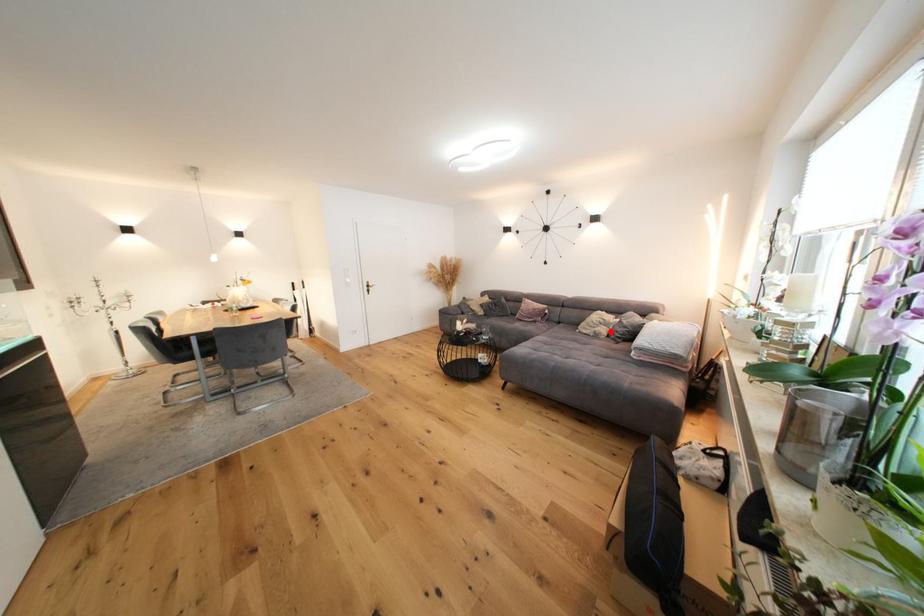
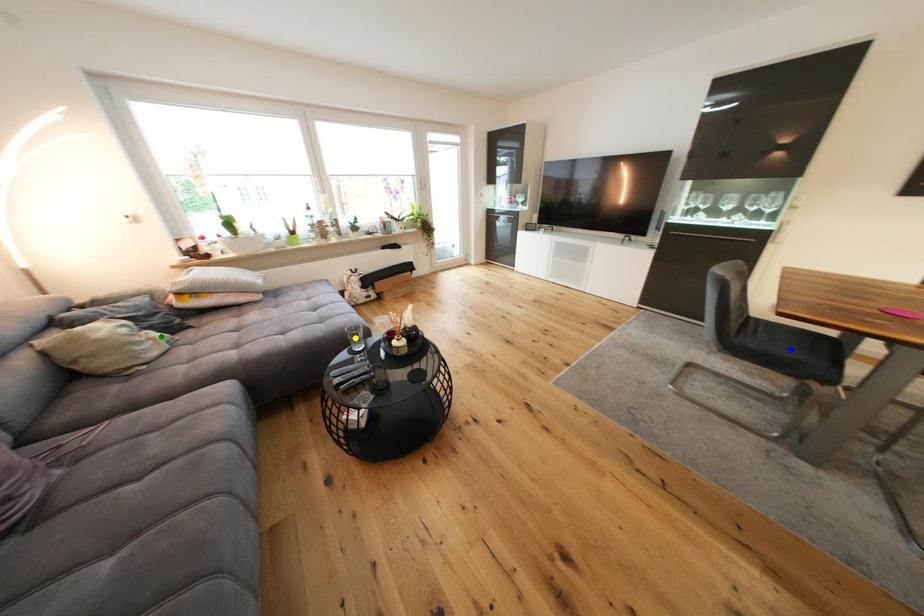
Question: I am providing you with two images of the same scene from different viewpoints. A red point is marked on the first image. You are given multiple points on the second image. Which point in image 2 represents the same 3d spot as the red point in image 1?

Choices:
 (A) yellow point
 (B) green point
 (C) blue point

Answer: (B)